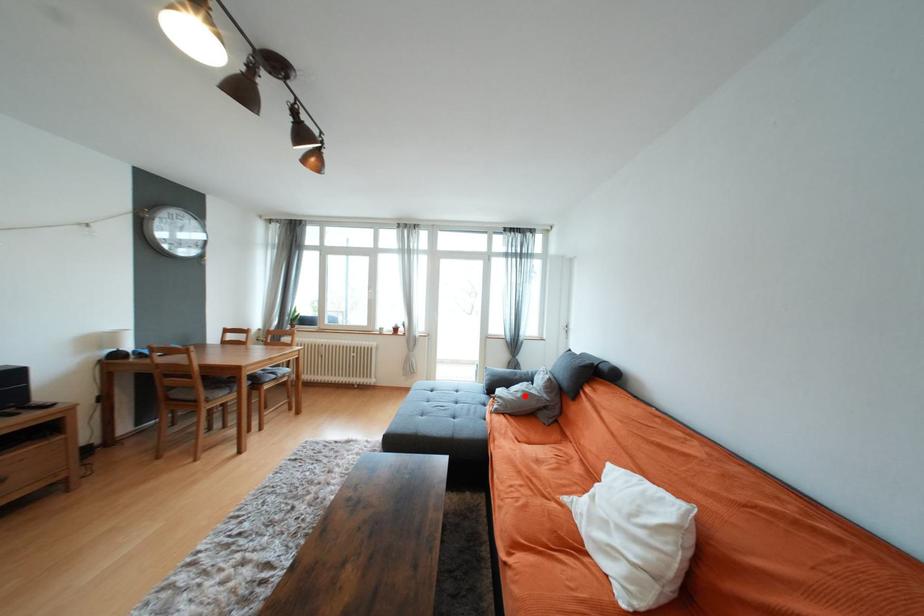
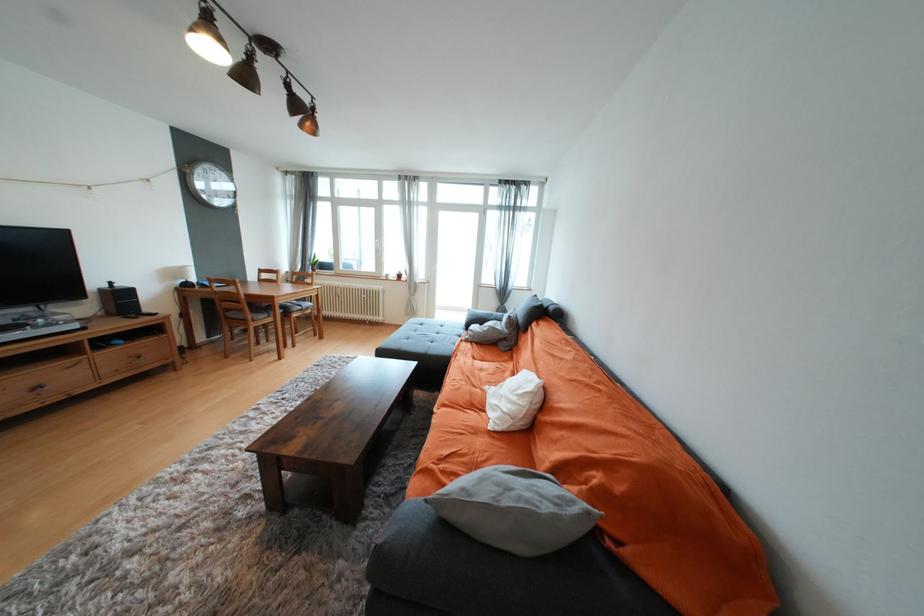
Find the pixel in the second image that matches the highlighted location in the first image.

(492, 330)